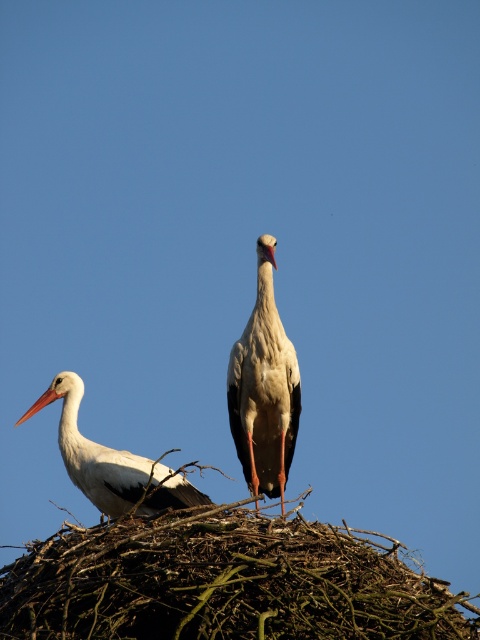
Question: Considering the relative positions of white matte bird at left and orange matte beak at upper left in the image provided, where is white matte bird at left located with respect to orange matte beak at upper left?

Choices:
 (A) below
 (B) above

Answer: (A)

Question: Considering the real-world distances, which object is closest to the brown twigs nest at center?

Choices:
 (A) orange matte beak at upper left
 (B) white matte stork at center

Answer: (B)

Question: Which of the following is the closest to the observer?

Choices:
 (A) (67, 410)
 (B) (368, 540)

Answer: (B)

Question: Which object is closer to the camera taking this photo?

Choices:
 (A) white matte bird at left
 (B) white matte stork at center
 (C) orange matte beak at upper left

Answer: (A)

Question: Observing the image, what is the correct spatial positioning of white matte bird at left in reference to orange matte beak at upper left?

Choices:
 (A) left
 (B) right

Answer: (B)

Question: Does white matte bird at left have a greater width compared to orange matte beak at upper left?

Choices:
 (A) no
 (B) yes

Answer: (A)